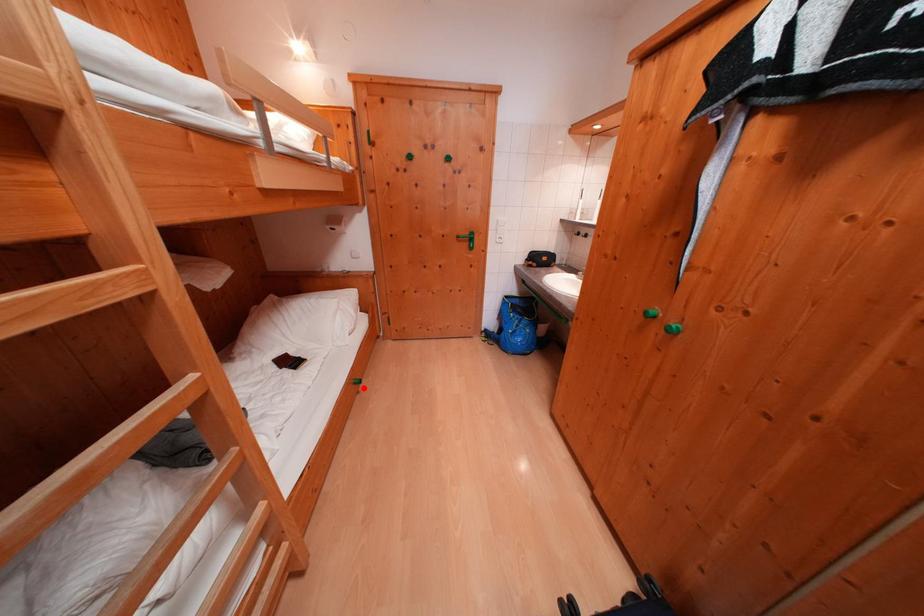
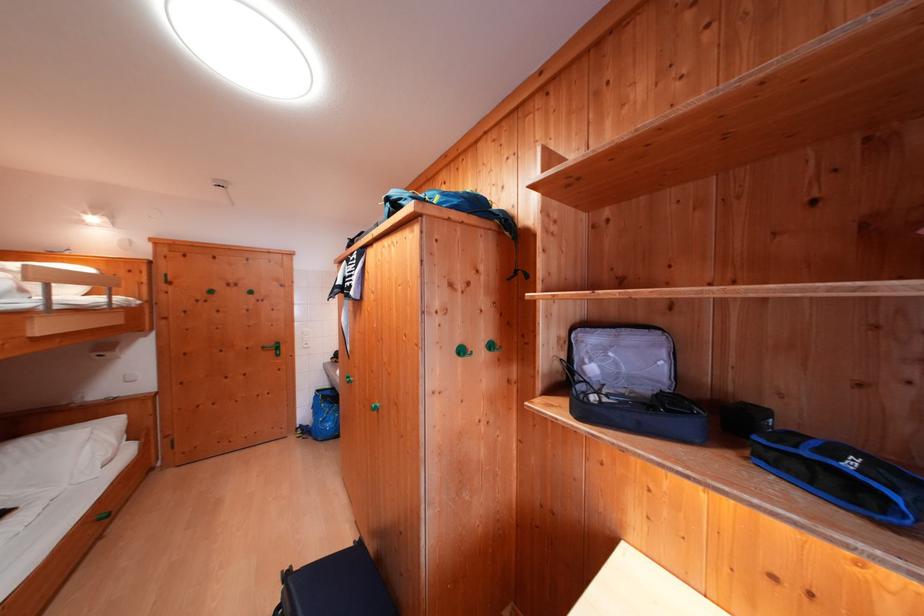
Question: I am providing you with two images of the same scene from different viewpoints. In image1, a red point is highlighted. Considering the same 3D point in image2, which of the following is correct?

Choices:
 (A) It is closer
 (B) It is farther

Answer: (B)